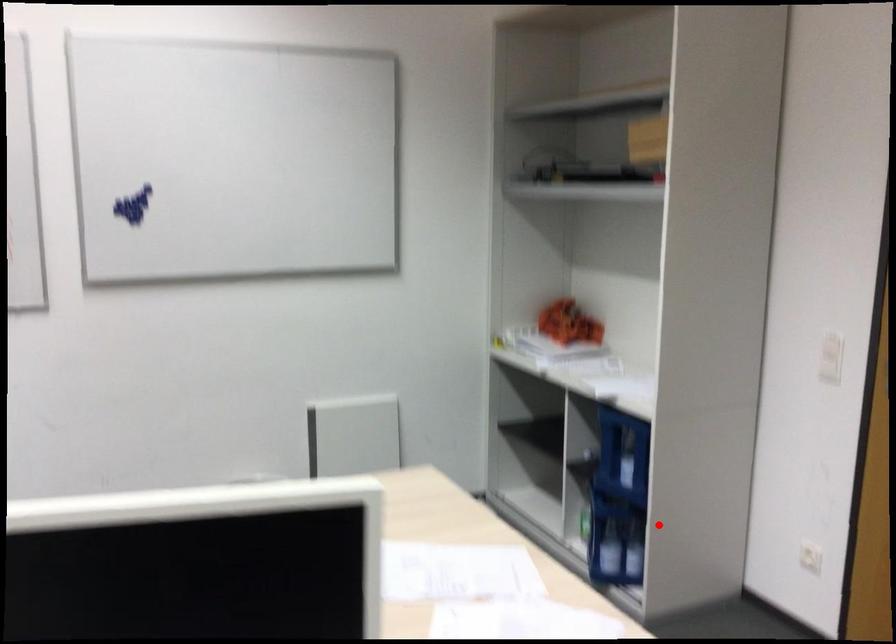
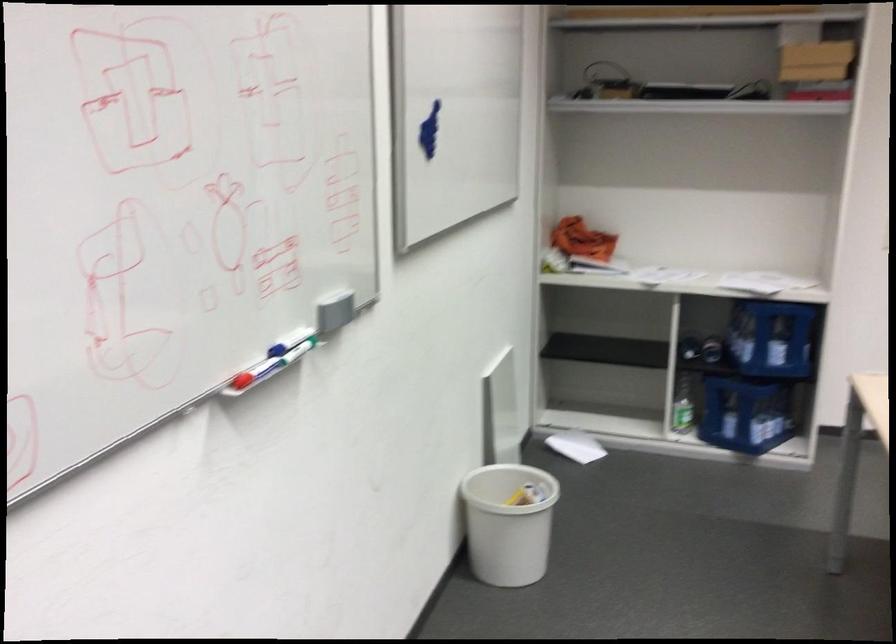
Question: I am providing you with two images of the same scene from different viewpoints. A red point is marked on the first image. Can you still see the location of the red point in image 2?

Choices:
 (A) Yes
 (B) No

Answer: (A)